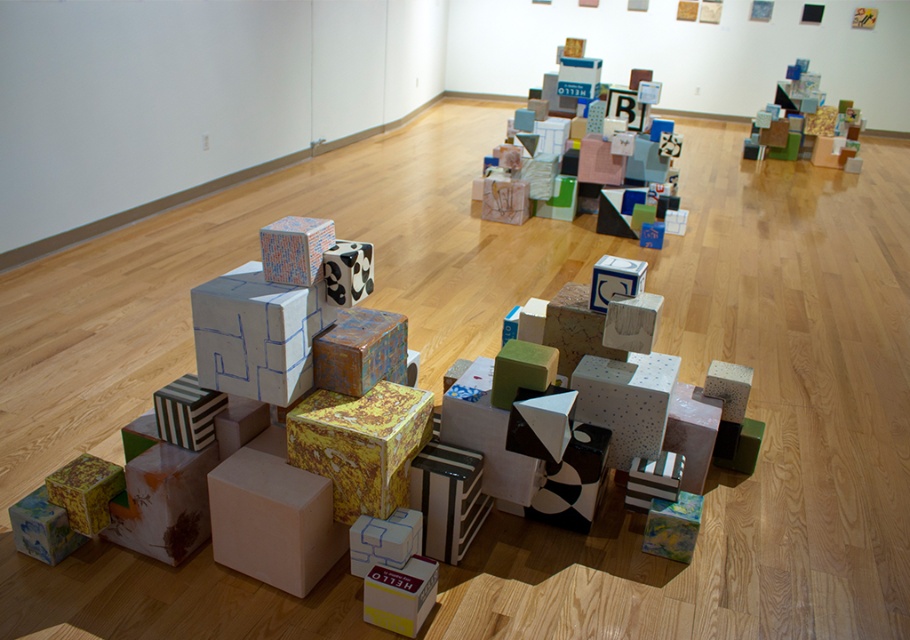
Question: Which point appears closest to the camera in this image?

Choices:
 (A) (373, 321)
 (B) (349, 509)
 (C) (632, 176)

Answer: (B)

Question: Which point is farther from the camera taking this photo?

Choices:
 (A) (346, 376)
 (B) (46, 484)
 (C) (330, 444)
 (D) (622, 150)

Answer: (D)

Question: Which of the following is the closest to the observer?

Choices:
 (A) yellow textured cardboard box at center
 (B) yellow textured cube at lower left
 (C) textured multicolored cube at center

Answer: (A)

Question: Can you confirm if textured multicolored cube at center is positioned to the left of yellow textured cube at lower left?

Choices:
 (A) no
 (B) yes

Answer: (A)

Question: From the image, what is the correct spatial relationship of matte cardboard box at center in relation to textured multicolored cube at center?

Choices:
 (A) left
 (B) right

Answer: (B)

Question: Does yellow textured cardboard box at center have a smaller size compared to textured multicolored cube at center?

Choices:
 (A) no
 (B) yes

Answer: (A)